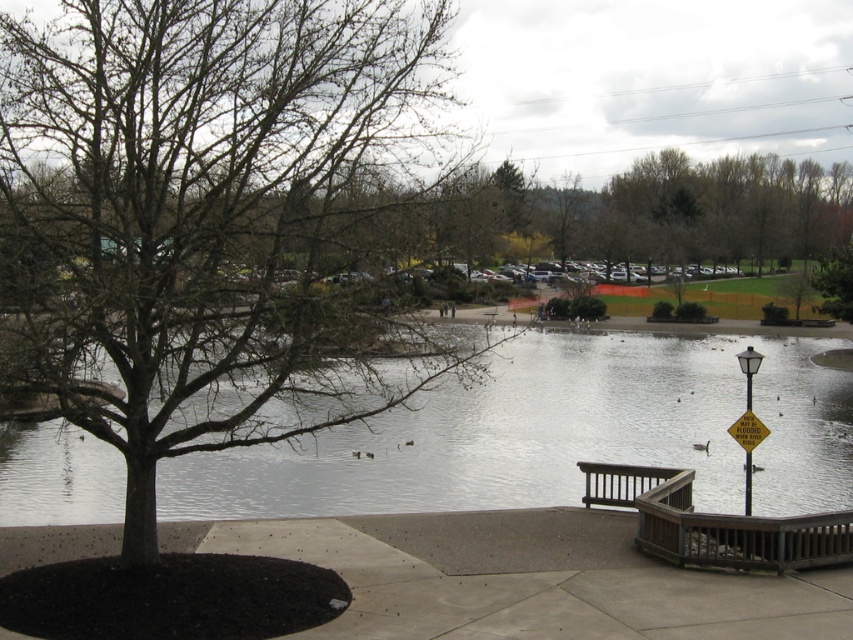
You are a park visitor trying to decide where to place your picnic blanket. You see the brown bark tree at left and the concrete at lower center. Which area has more space available for your blanket?

The concrete at lower center has more space available because it occupies more area than the brown bark tree at left.